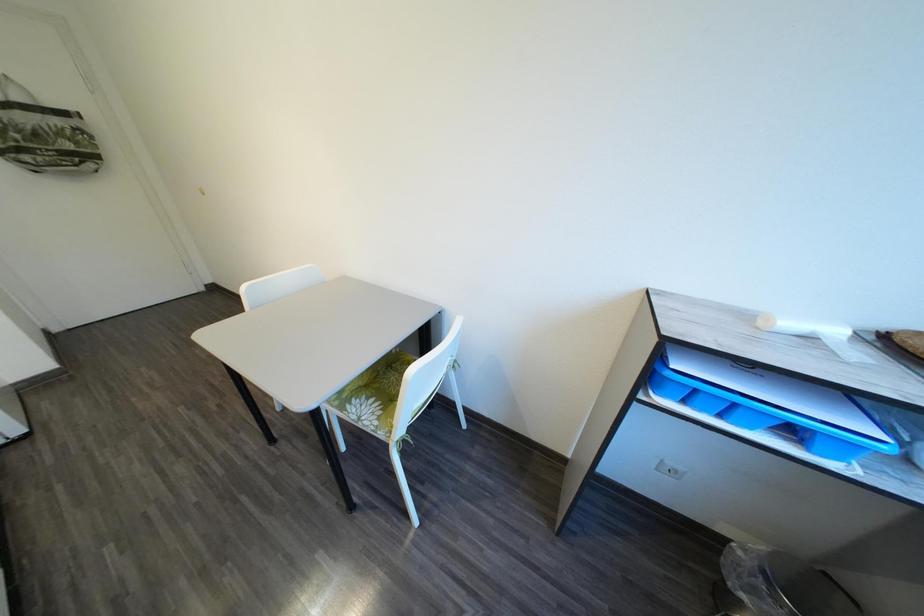
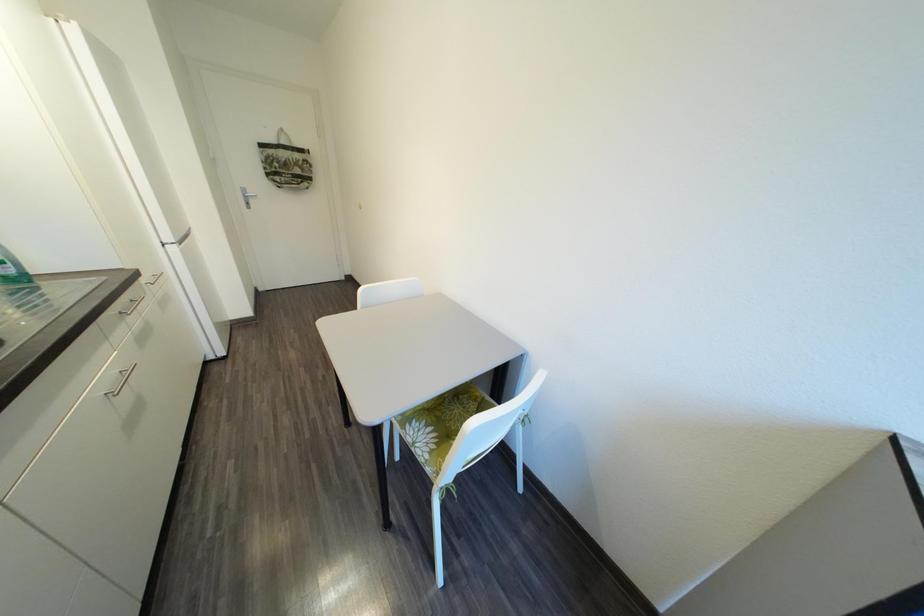
Question: The images are taken continuously from a first-person perspective. In which direction is your viewpoint rotating?

Choices:
 (A) Left
 (B) Right
 (C) Up
 (D) Down

Answer: (A)